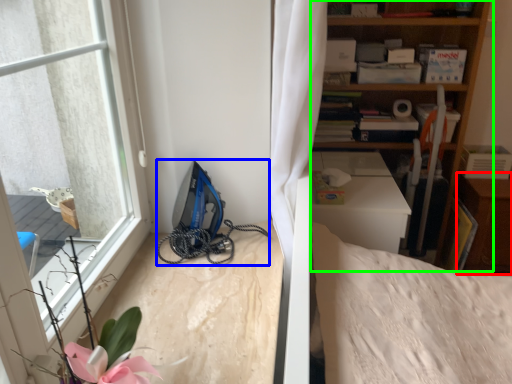
Question: Estimate the real-world distances between objects in this image. Which object is farther from dresser (highlighted by a red box), equipment (highlighted by a blue box) or shelf (highlighted by a green box)?

Choices:
 (A) equipment
 (B) shelf

Answer: (A)